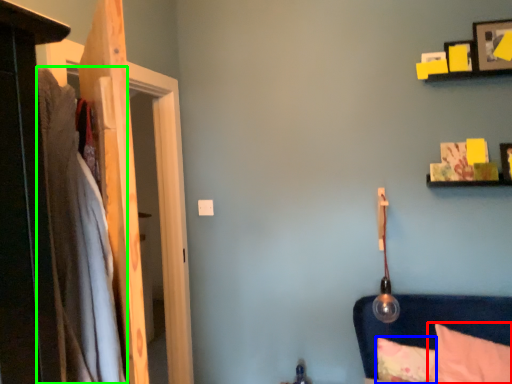
Question: Based on their relative distances, which object is farther from pillow (highlighted by a red box)? Choose from pillow (highlighted by a blue box) and blanket (highlighted by a green box).

Choices:
 (A) pillow
 (B) blanket

Answer: (B)